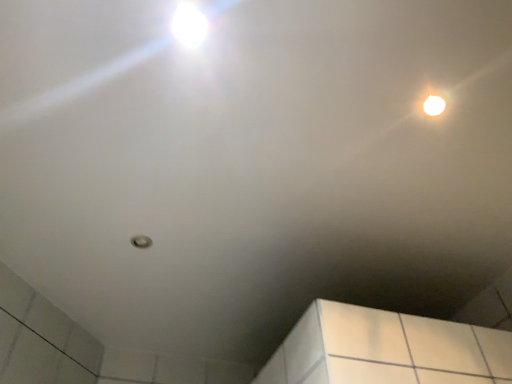
Question: Is white glossy droplight at upper right, arranged as the 2th droplight when viewed from the top, thinner than white glossy droplight at upper left, arranged as the first droplight when viewed from the left?

Choices:
 (A) yes
 (B) no

Answer: (A)

Question: Does white glossy droplight at upper right, marked as the first droplight in a bottom-to-top arrangement, lie behind white glossy droplight at upper left, arranged as the 1th droplight when viewed from the top?

Choices:
 (A) yes
 (B) no

Answer: (A)

Question: From the image's perspective, would you say white glossy droplight at upper right, acting as the 2th droplight starting from the front, is positioned over white glossy droplight at upper left, the 1th droplight viewed from the front?

Choices:
 (A) no
 (B) yes

Answer: (A)

Question: Could you tell me if white glossy droplight at upper right, the second droplight viewed from the left, is facing white glossy droplight at upper left, arranged as the 1th droplight when viewed from the top?

Choices:
 (A) no
 (B) yes

Answer: (B)

Question: Is white glossy droplight at upper right, the second droplight viewed from the left, to the left of white glossy droplight at upper left, arranged as the first droplight when viewed from the left, from the viewer's perspective?

Choices:
 (A) yes
 (B) no

Answer: (B)

Question: Does white glossy droplight at upper right, marked as the 1th droplight in a back-to-front arrangement, have a lesser height compared to white glossy droplight at upper left, placed as the second droplight when sorted from back to front?

Choices:
 (A) no
 (B) yes

Answer: (A)

Question: Is white glossy droplight at upper left, arranged as the 1th droplight when viewed from the top, facing towards white glossy droplight at upper right, acting as the 2th droplight starting from the front?

Choices:
 (A) yes
 (B) no

Answer: (A)

Question: Is white glossy droplight at upper left, arranged as the first droplight when viewed from the left, positioned with its back to white glossy droplight at upper right, the second droplight viewed from the left?

Choices:
 (A) no
 (B) yes

Answer: (A)

Question: Is white glossy droplight at upper left, which appears as the 2th droplight when ordered from the bottom, at the left side of white glossy droplight at upper right, acting as the 2th droplight starting from the front?

Choices:
 (A) no
 (B) yes

Answer: (B)

Question: From a real-world perspective, does white glossy droplight at upper left, arranged as the 1th droplight when viewed from the top, stand above white glossy droplight at upper right, the 1th droplight in the right-to-left sequence?

Choices:
 (A) no
 (B) yes

Answer: (A)

Question: Is white glossy droplight at upper left, placed as the second droplight when sorted from back to front, outside white glossy droplight at upper right, the 1th droplight in the right-to-left sequence?

Choices:
 (A) yes
 (B) no

Answer: (A)

Question: Is white glossy droplight at upper left, the 1th droplight viewed from the front, thinner than white glossy droplight at upper right, marked as the 1th droplight in a back-to-front arrangement?

Choices:
 (A) no
 (B) yes

Answer: (A)

Question: From the image's perspective, is white glossy droplight at upper left, placed as the second droplight when sorted from back to front, located above or below white glossy droplight at upper right, arranged as the 2th droplight when viewed from the top?

Choices:
 (A) above
 (B) below

Answer: (A)